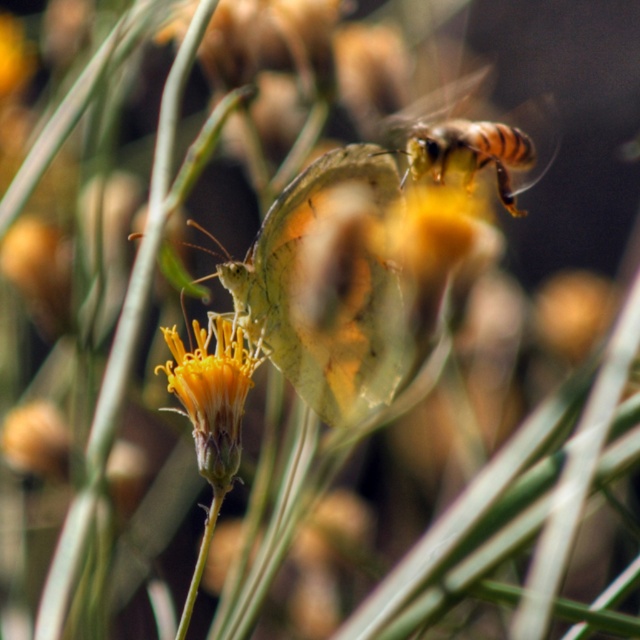
Which is more to the right, brown striped bee at upper right or yellow matte flower at center?

brown striped bee at upper right is more to the right.

Can you confirm if brown striped bee at upper right is taller than yellow matte flower at center?

Yes, brown striped bee at upper right is taller than yellow matte flower at center.

Who is more distant from viewer, (481, 148) or (205, 404)?

The point (481, 148) is more distant.

The width and height of the screenshot is (640, 640). In order to click on brown striped bee at upper right in this screenshot , I will do `click(474, 140)`.

Does translucent yellow butterfly at center have a lesser width compared to yellow matte flower at center?

No.

In the scene shown: Who is more forward, (266,285) or (195,422)?

Point (195,422)

Is point (340, 209) less distant than point (228, 392)?

No, (340, 209) is further to viewer.

Identify the location of translucent yellow butterfly at center. The image size is (640, 640). (x=326, y=285).

Can you confirm if translucent yellow butterfly at center is bigger than brown striped bee at upper right?

No.

Which is in front, point (369, 161) or point (440, 109)?

Positioned in front is point (369, 161).

The height and width of the screenshot is (640, 640). I want to click on translucent yellow butterfly at center, so click(326, 285).